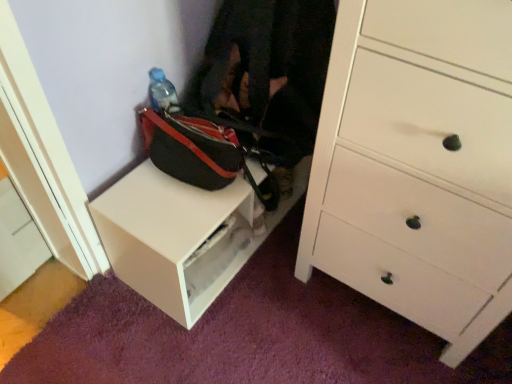
Where is `vacant area situated to the left side of white wood chest of drawers at center right`? vacant area situated to the left side of white wood chest of drawers at center right is located at coordinates (274, 316).